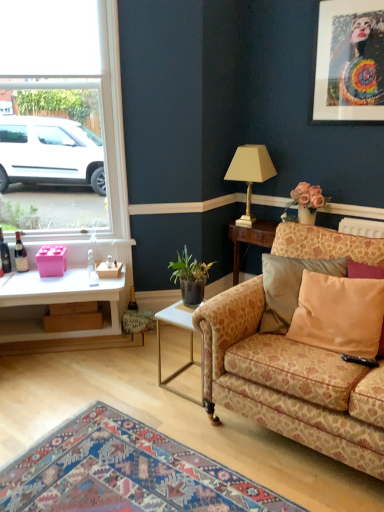
Locate an element on the screen. clear glass bottle at left, the 3th bottle when ordered from left to right is located at coordinates (92, 270).

Image resolution: width=384 pixels, height=512 pixels. What are the coordinates of `matte glass bottle at left, the second bottle when ordered from right to left` in the screenshot? It's located at (20, 255).

What do you see at coordinates (190, 345) in the screenshot? I see `white metal side table at lower center` at bounding box center [190, 345].

At what (x,y) coordinates should I click in order to perform the action: click on white glass window at upper left. Please return your answer as a coordinate pair (x, y). The width and height of the screenshot is (384, 512). Looking at the image, I should click on (64, 116).

Identify the location of matte glass bottle at left, the 1th bottle when ordered from left to right. This screenshot has height=512, width=384. (4, 254).

Is brown cardboard box at lower left, the 1th box from the bottom, turned away from floral-patterned fabric couch at right?

No, floral-patterned fabric couch at right is not at the back of brown cardboard box at lower left, the 1th box from the bottom.

Which point is more forward, (61, 329) or (206, 383)?

The point (206, 383) is closer to the camera.

Is brown cardboard box at lower left, placed as the 2th box when sorted from top to bottom, closer to camera compared to floral-patterned fabric couch at right?

No, it is behind floral-patterned fabric couch at right.

Is brown cardboard box at lower left, placed as the 2th box when sorted from top to bottom, to the left of pink matte plastic box at left, which is the first box in top-to-bottom order, from the viewer's perspective?

Incorrect, brown cardboard box at lower left, placed as the 2th box when sorted from top to bottom, is not on the left side of pink matte plastic box at left, which is the first box in top-to-bottom order.

Is brown cardboard box at lower left, the 1th box from the bottom, closer to the viewer compared to pink matte plastic box at left, which is the first box in top-to-bottom order?

No, it is behind pink matte plastic box at left, which is the first box in top-to-bottom order.

Considering the positions of point (69, 304) and point (62, 251), is point (69, 304) closer or farther from the camera than point (62, 251)?

Clearly, point (69, 304) is closer to the camera than point (62, 251).

How distant is brown cardboard box at lower left, the 1th box from the bottom, from pink matte plastic box at left, which is the first box in top-to-bottom order?

brown cardboard box at lower left, the 1th box from the bottom, and pink matte plastic box at left, which is the first box in top-to-bottom order, are 32.07 centimeters apart.

Does green leafy plant in pot at center appear on the right side of metallic silver picture frame at upper right?

No.

Does green leafy plant in pot at center have a greater width compared to metallic silver picture frame at upper right?

Indeed, green leafy plant in pot at center has a greater width compared to metallic silver picture frame at upper right.

Locate an element on the screen. The height and width of the screenshot is (512, 384). houseplant that appears below the metallic silver picture frame at upper right (from the image's perspective) is located at coordinates (190, 277).

From a real-world perspective, is green leafy plant in pot at center positioned under metallic silver picture frame at upper right based on gravity?

Yes, from a real-world perspective, green leafy plant in pot at center is under metallic silver picture frame at upper right.

Is point (82, 14) behind point (186, 324)?

Yes, it is.

Does white glass window at upper left turn towards white metal side table at lower center?

No, white glass window at upper left does not turn towards white metal side table at lower center.

Would you say white glass window at upper left is a long distance from white metal side table at lower center?

Yes, white glass window at upper left is far from white metal side table at lower center.

Considering the sizes of objects clear glass bottle at left, the 3th bottle when ordered from left to right, and matte glass bottle at left, the second bottle when ordered from right to left, in the image provided, who is bigger, clear glass bottle at left, the 3th bottle when ordered from left to right, or matte glass bottle at left, the second bottle when ordered from right to left,?

matte glass bottle at left, the second bottle when ordered from right to left.

Does clear glass bottle at left, positioned as the first bottle in right-to-left order, appear on the left side of matte glass bottle at left, the second bottle when ordered from right to left?

No.

From the image's perspective, which one is positioned lower, clear glass bottle at left, the 3th bottle when ordered from left to right, or matte glass bottle at left, the second bottle from the left?

clear glass bottle at left, the 3th bottle when ordered from left to right, is shown below in the image.

Can you confirm if clear glass bottle at left, positioned as the first bottle in right-to-left order, is thinner than matte glass bottle at left, the second bottle when ordered from right to left?

Yes, clear glass bottle at left, positioned as the first bottle in right-to-left order, is thinner than matte glass bottle at left, the second bottle when ordered from right to left.

Based on their sizes in the image, would you say gold metallic lamp at upper center is bigger or smaller than matte glass bottle at left, the second bottle when ordered from right to left?

Clearly, gold metallic lamp at upper center is larger in size than matte glass bottle at left, the second bottle when ordered from right to left.

I want to click on the 2nd bottle counting from the left of the gold metallic lamp at upper center, so click(x=20, y=255).

Is gold metallic lamp at upper center inside or outside of matte glass bottle at left, the second bottle from the left?

gold metallic lamp at upper center is not enclosed by matte glass bottle at left, the second bottle from the left.

Is point (249, 224) closer or farther from the camera than point (24, 257)?

Point (249, 224) appears to be farther away from the viewer than point (24, 257).

Can you confirm if white metal side table at lower center is bigger than clear glass bottle at left, the 3th bottle when ordered from left to right?

Yes, white metal side table at lower center is bigger than clear glass bottle at left, the 3th bottle when ordered from left to right.

Is white metal side table at lower center closer to camera compared to clear glass bottle at left, the 3th bottle when ordered from left to right?

Yes, the depth of white metal side table at lower center is less than that of clear glass bottle at left, the 3th bottle when ordered from left to right.

You are a GUI agent. You are given a task and a screenshot of the screen. Output one action in this format:
    pyautogui.click(x=<x>, y=<y>)
    Task: Click on the table on the right side of clear glass bottle at left, positioned as the first bottle in right-to-left order
    
    Given the screenshot: What is the action you would take?
    pyautogui.click(x=190, y=345)

Which of these two, white metal side table at lower center or clear glass bottle at left, positioned as the first bottle in right-to-left order, stands taller?

With more height is white metal side table at lower center.

Find the location of a particular element. This screenshot has width=384, height=512. the 1st box to the left of the floral-patterned fabric couch at right, counting from the anchor's position is located at coordinates (72, 317).

Locate an element on the screen. box located in front of the brown cardboard box at lower left, placed as the 2th box when sorted from top to bottom is located at coordinates (52, 261).

Considering their positions, is matte glass bottle at left, which appears as the 3th bottle when viewed from the right, positioned closer to brown cardboard box at lower left, the 1th box from the bottom, than green leafy plant in pot at center?

matte glass bottle at left, which appears as the 3th bottle when viewed from the right, is positioned closer to the anchor brown cardboard box at lower left, the 1th box from the bottom.

From the image, which object appears to be nearer to gold metallic lamp at upper center, brown cardboard box at lower left, the 1th box from the bottom, or metallic silver picture frame at upper right?

metallic silver picture frame at upper right lies closer to gold metallic lamp at upper center than the other object.

Looking at the image, which one is located closer to green leafy plant in pot at center, clear glass bottle at left, the 3th bottle when ordered from left to right, or brown cardboard box at lower left, placed as the 2th box when sorted from top to bottom?

clear glass bottle at left, the 3th bottle when ordered from left to right.

Based on the photo, when comparing their distances from beige fabric pillow at right, does brown cardboard box at lower left, placed as the 2th box when sorted from top to bottom, or white glass window at upper left seem further?

Based on the image, white glass window at upper left appears to be further to beige fabric pillow at right.

When comparing their distances from clear glass bottle at left, the 3th bottle when ordered from left to right, does white glass window at upper left or pink matte plastic box at left, which is the first box in top-to-bottom order, seem further?

white glass window at upper left is positioned further to the anchor clear glass bottle at left, the 3th bottle when ordered from left to right.

Estimate the real-world distances between objects in this image. Which object is further from white metal side table at lower center, white glass window at upper left or green leafy plant in pot at center?

white glass window at upper left lies further to white metal side table at lower center than the other object.

Estimate the real-world distances between objects in this image. Which object is further from metallic silver picture frame at upper right, gold metallic lamp at upper center or beige fabric pillow at right?

beige fabric pillow at right lies further to metallic silver picture frame at upper right than the other object.

Looking at the image, which one is located closer to clear glass bottle at left, the 3th bottle when ordered from left to right, matte glass bottle at left, the 1th bottle when ordered from left to right, or floral-patterned fabric couch at right?

Based on the image, matte glass bottle at left, the 1th bottle when ordered from left to right, appears to be nearer to clear glass bottle at left, the 3th bottle when ordered from left to right.

The width and height of the screenshot is (384, 512). Find the location of `studio couch located between matte glass bottle at left, the second bottle from the left, and metallic silver picture frame at upper right in the left-right direction`. studio couch located between matte glass bottle at left, the second bottle from the left, and metallic silver picture frame at upper right in the left-right direction is located at coordinates (290, 382).

Image resolution: width=384 pixels, height=512 pixels. Find the location of `box located between pink matte plastic box at left, which is the first box in top-to-bottom order, and gold metallic lamp at upper center in the left-right direction`. box located between pink matte plastic box at left, which is the first box in top-to-bottom order, and gold metallic lamp at upper center in the left-right direction is located at coordinates (72, 317).

Locate an element on the screen. The width and height of the screenshot is (384, 512). window between pink matte plastic box at left, the second box in the bottom-to-top sequence, and green leafy plant in pot at center is located at coordinates (64, 116).

Where is `box located between white glass window at upper left and floral-patterned fabric couch at right in the left-right direction`? This screenshot has height=512, width=384. box located between white glass window at upper left and floral-patterned fabric couch at right in the left-right direction is located at coordinates (72, 317).